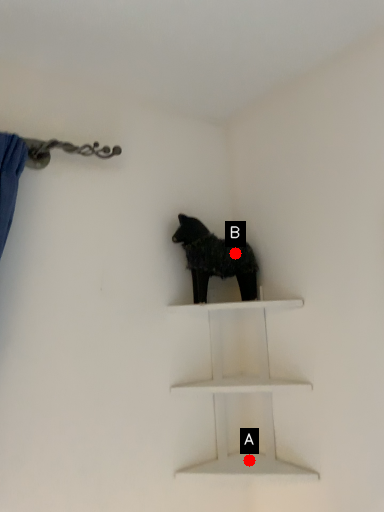
Question: Two points are circled on the image, labeled by A and B beside each circle. Which point is closer to the camera?

Choices:
 (A) A is closer
 (B) B is closer

Answer: (A)